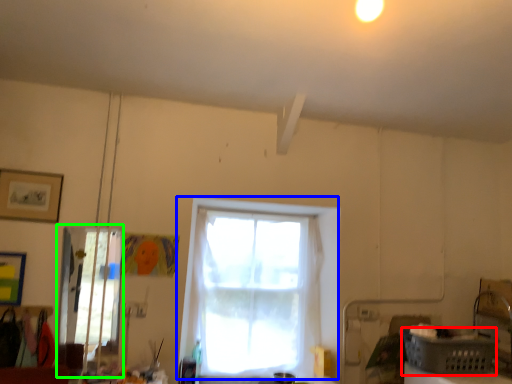
Question: Which object is positioned farthest from basket (highlighted by a red box)? Select from window (highlighted by a blue box) and glass door (highlighted by a green box).

Choices:
 (A) window
 (B) glass door

Answer: (B)